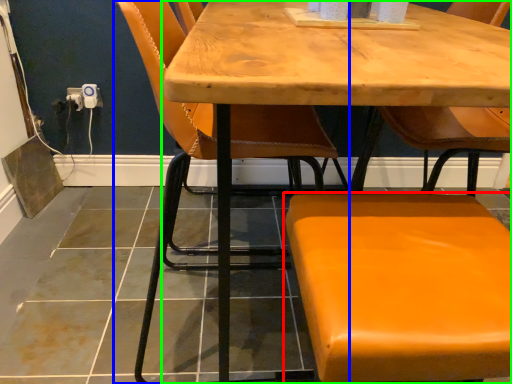
Question: Which object is positioned farthest from chair (highlighted by a red box)? Select from chair (highlighted by a blue box) and table (highlighted by a green box).

Choices:
 (A) chair
 (B) table

Answer: (A)